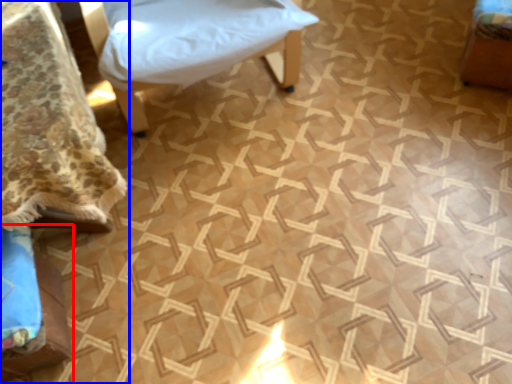
Question: Which object is further to the camera taking this photo, furniture (highlighted by a red box) or furniture (highlighted by a blue box)?

Choices:
 (A) furniture
 (B) furniture

Answer: (A)